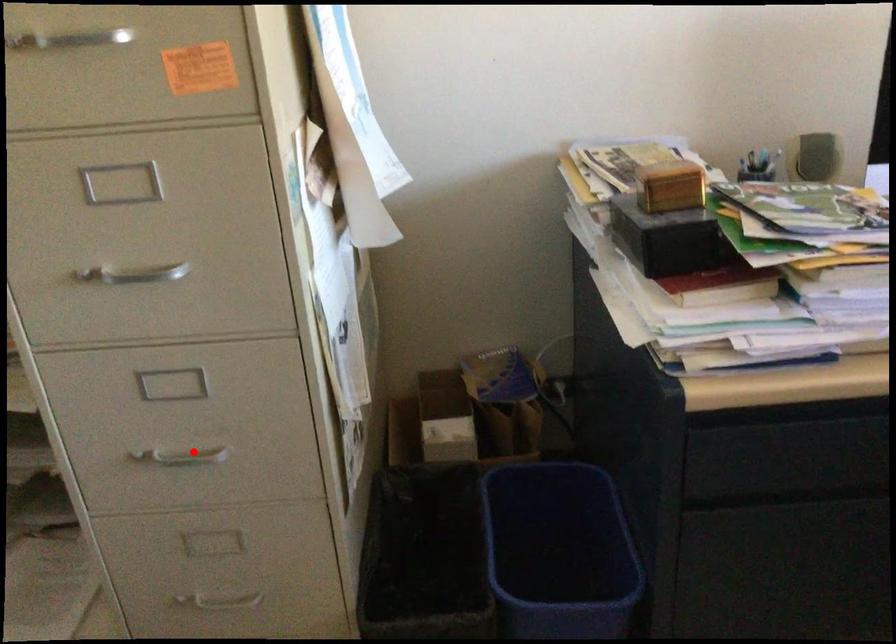
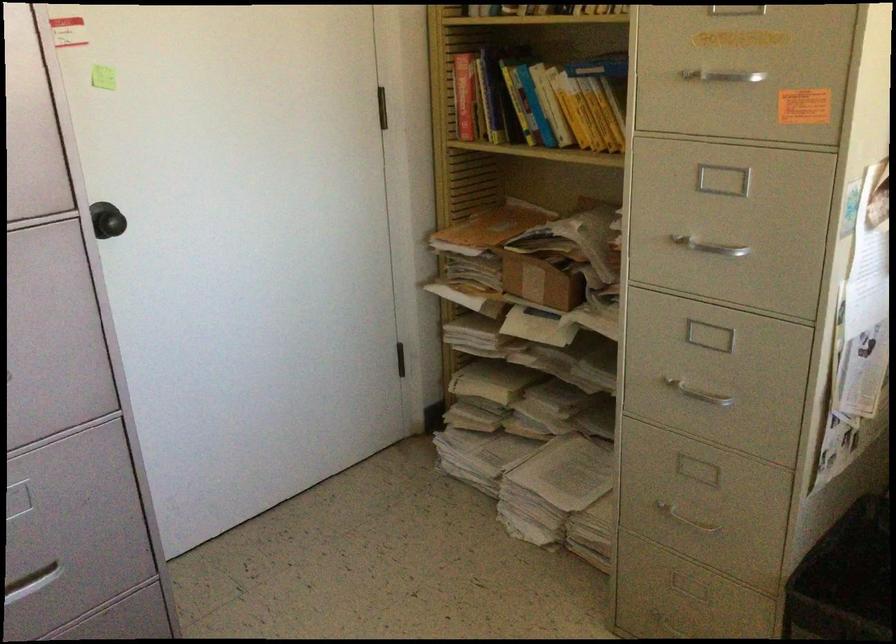
Question: I am providing you with two images of the same scene from different viewpoints. Image1 has a red point marked. In image2, the corresponding 3D location appears at what relative position? Reply with the corresponding letter.

Choices:
 (A) Closer
 (B) Farther

Answer: (B)